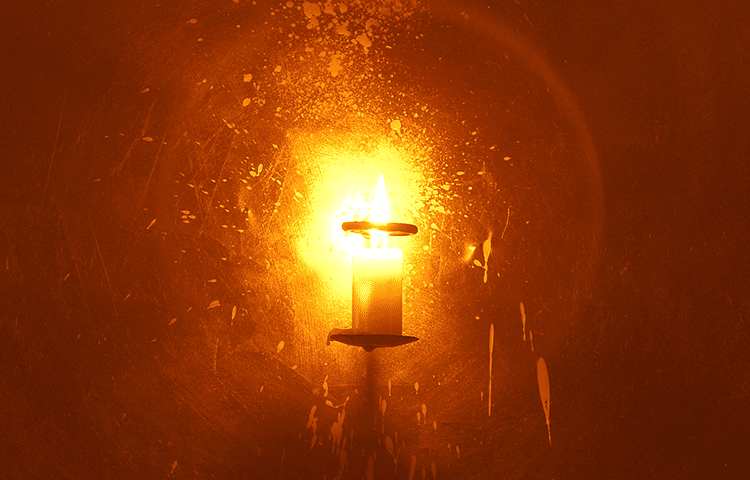
Where is `background of yellow light`? background of yellow light is located at coordinates (667, 94).